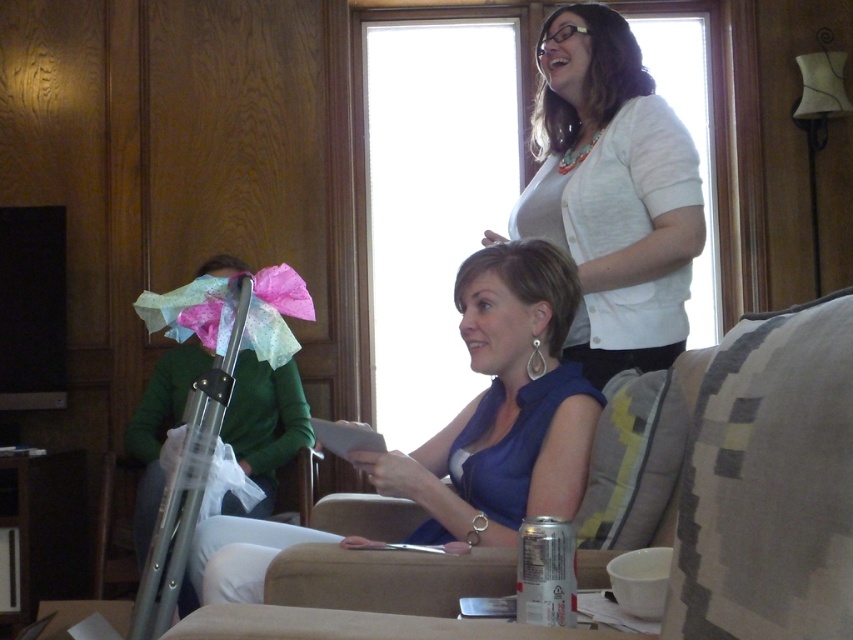
Question: Does white matte cardigan at upper center have a lesser width compared to blue fabric dress at center?

Choices:
 (A) yes
 (B) no

Answer: (A)

Question: Which of the following is the farthest from the observer?

Choices:
 (A) white matte cardigan at upper center
 (B) green fabric shirt at left
 (C) blue fabric dress at center

Answer: (B)

Question: Is blue fabric dress at center bigger than green fabric shirt at left?

Choices:
 (A) yes
 (B) no

Answer: (A)

Question: Which object appears farthest from the camera in this image?

Choices:
 (A) white matte cardigan at upper center
 (B) blue fabric dress at center
 (C) green fabric shirt at left

Answer: (C)

Question: Does white matte cardigan at upper center have a lesser width compared to green fabric shirt at left?

Choices:
 (A) yes
 (B) no

Answer: (A)

Question: Which is farther from the green fabric shirt at left?

Choices:
 (A) blue fabric dress at center
 (B) white matte cardigan at upper center

Answer: (B)